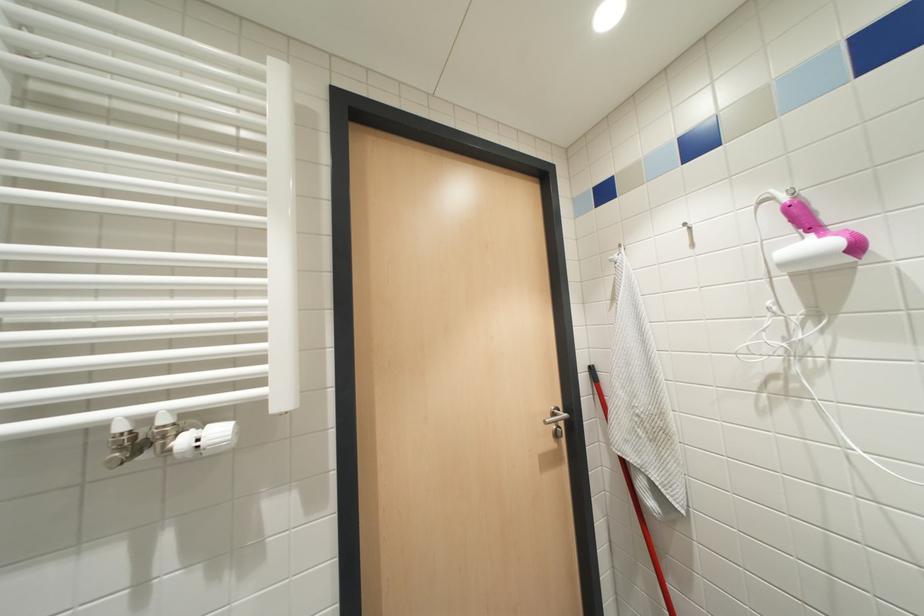
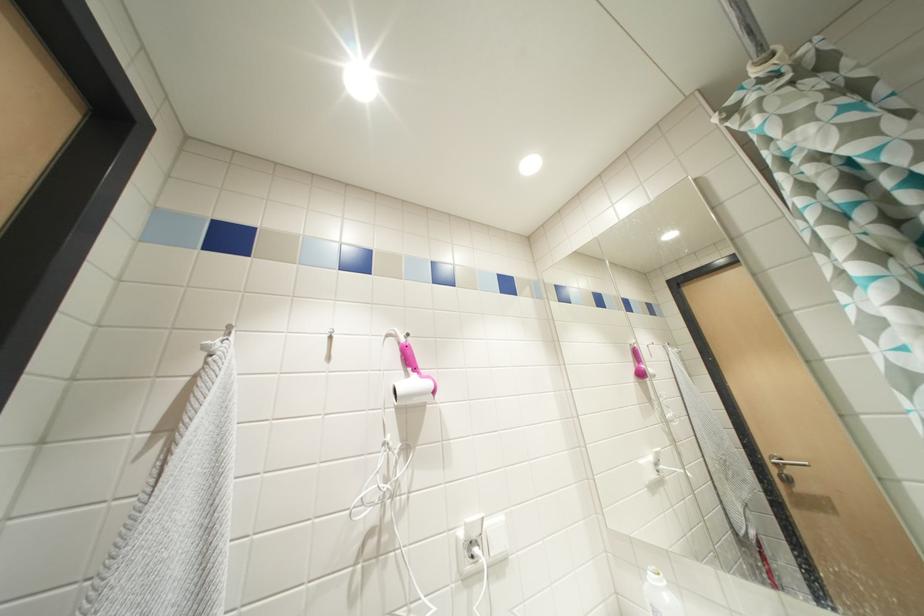
The images are taken continuously from a first-person perspective. In which direction is your viewpoint rotating?

The rotation direction of the camera is right-up.